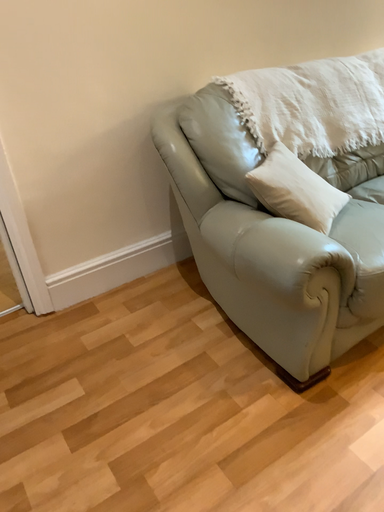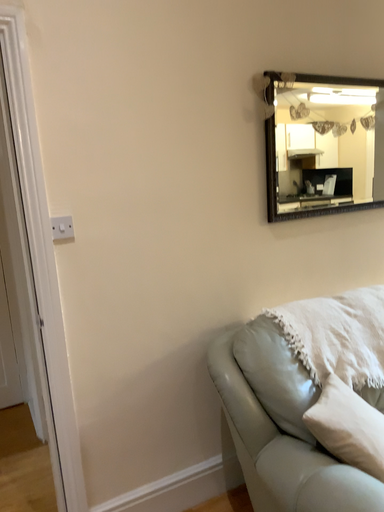
Question: Which way did the camera rotate in the video?

Choices:
 (A) rotated upward
 (B) rotated downward

Answer: (A)